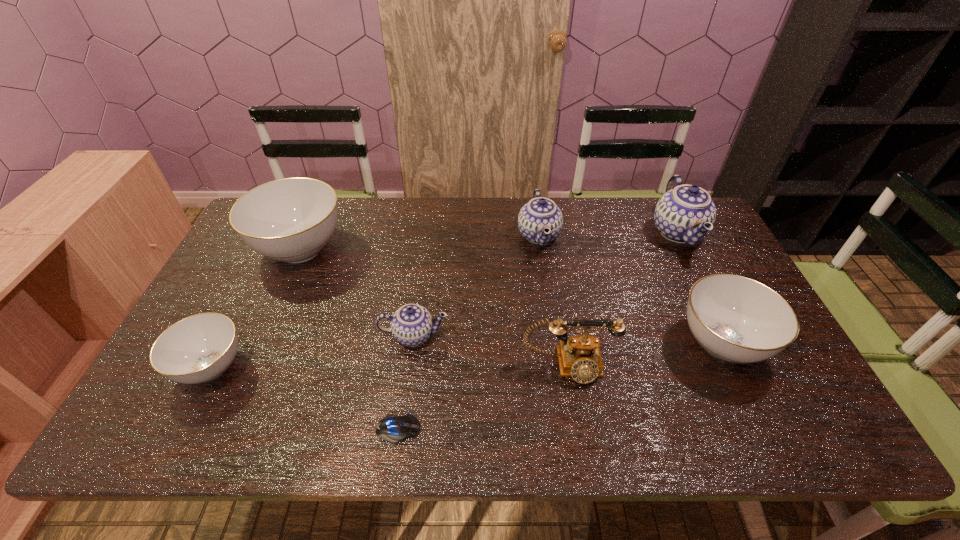
Where is `the shortest object`? This screenshot has width=960, height=540. the shortest object is located at coordinates (393, 428).

Identify the location of free location located 0.110m at the spout of the rightmost blue chinaware. (617, 233).

Find the location of `vacant space situated 0.130m at the spout of the rightmost blue chinaware`. vacant space situated 0.130m at the spout of the rightmost blue chinaware is located at coordinates (611, 233).

Find the location of a particular element. free spot located 0.190m at the spout of the rightmost blue chinaware is located at coordinates (592, 233).

This screenshot has height=540, width=960. In order to click on vacant space located 0.210m on the right of the farthest gray chinaware in this screenshot , I will do `click(414, 248)`.

Find the location of `blank area located 0.250m at the spout of the fourth chinaware from left to right`. blank area located 0.250m at the spout of the fourth chinaware from left to right is located at coordinates (441, 235).

Find the location of `vacant space located at the spout of the fourth chinaware from left to right`. vacant space located at the spout of the fourth chinaware from left to right is located at coordinates (462, 235).

The image size is (960, 540). What are the coordinates of `free space located at the spout of the fourth chinaware from left to right` in the screenshot? It's located at pos(483,235).

What are the coordinates of `vacant space located on the back of the rightmost gray chinaware` in the screenshot? It's located at (685, 268).

Locate an element on the screen. free space located at the spout of the nearest blue chinaware is located at coordinates (405, 407).